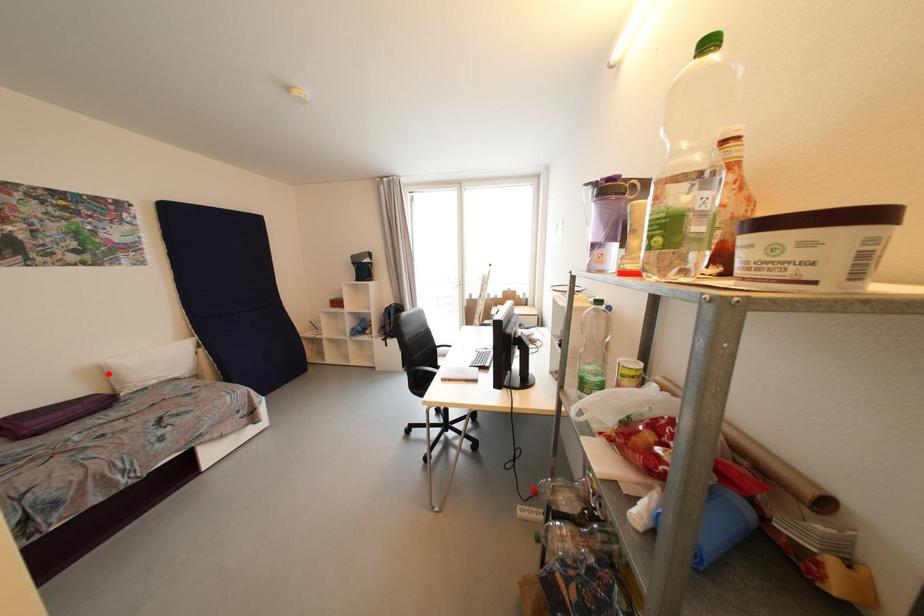
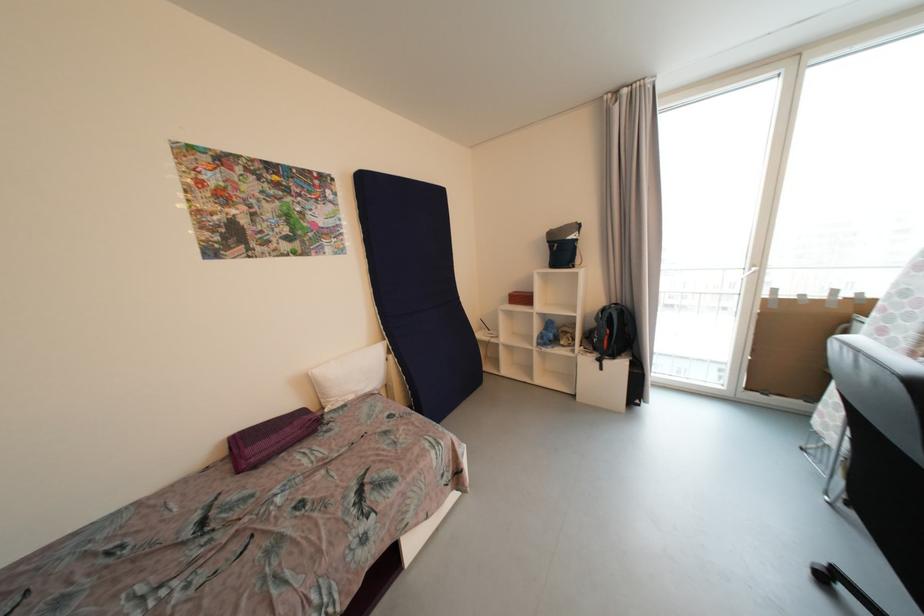
The point at the highlighted location is marked in the first image. Where is the corresponding point in the second image?

(315, 386)